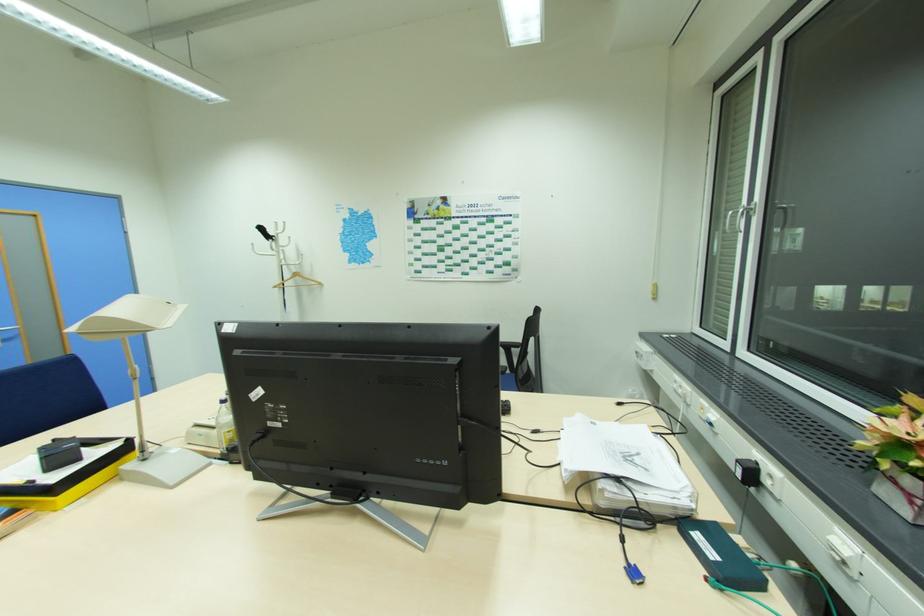
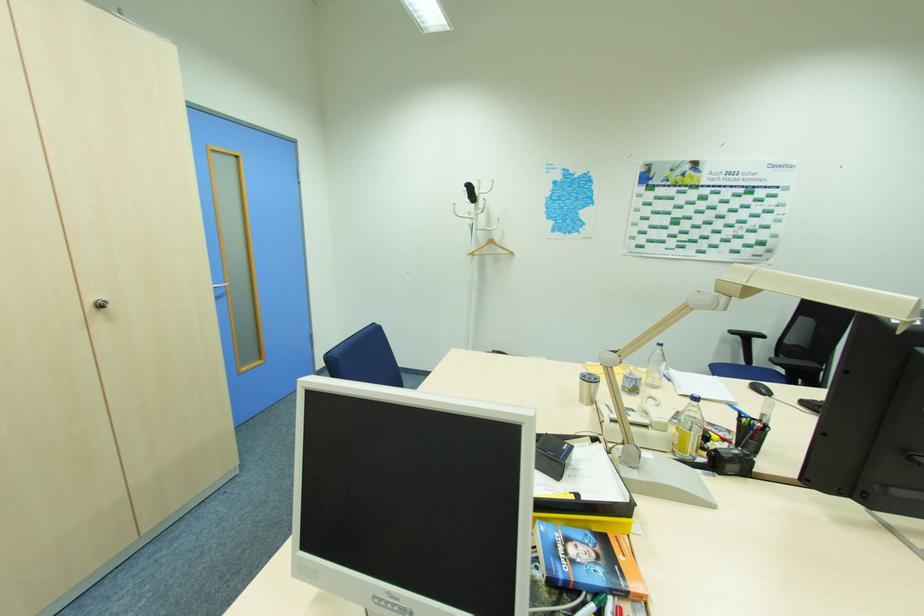
In the second image, find the point that corresponds to pixel 276 237 in the first image.

(479, 197)